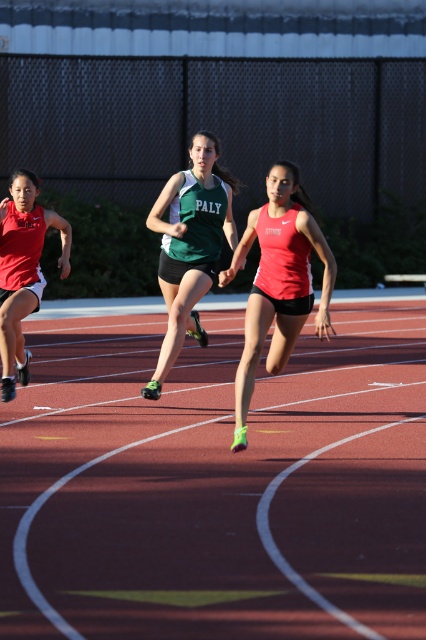
Question: Can you confirm if matte red tank top at center is positioned below matte red tank top at left?

Choices:
 (A) yes
 (B) no

Answer: (A)

Question: Which object is farther from the camera taking this photo?

Choices:
 (A) green matte jersey at center
 (B) red rubber track at center
 (C) matte red tank top at center
 (D) matte red tank top at left

Answer: (D)

Question: Which object is the farthest from the red rubber track at center?

Choices:
 (A) green matte jersey at center
 (B) matte red tank top at center
 (C) matte red tank top at left

Answer: (C)

Question: Is red rubber track at center thinner than matte red tank top at center?

Choices:
 (A) yes
 (B) no

Answer: (B)

Question: Is matte red tank top at center behind matte red tank top at left?

Choices:
 (A) yes
 (B) no

Answer: (B)

Question: Which object appears closest to the camera in this image?

Choices:
 (A) red rubber track at center
 (B) matte red tank top at center
 (C) green matte jersey at center

Answer: (A)